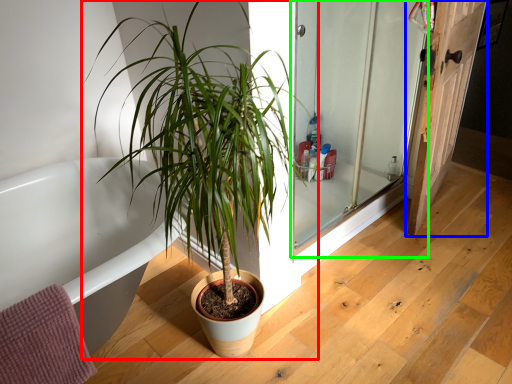
Question: Which is farther away from houseplant (highlighted by a red box)? door (highlighted by a blue box) or screen door (highlighted by a green box)?

Choices:
 (A) door
 (B) screen door

Answer: (A)